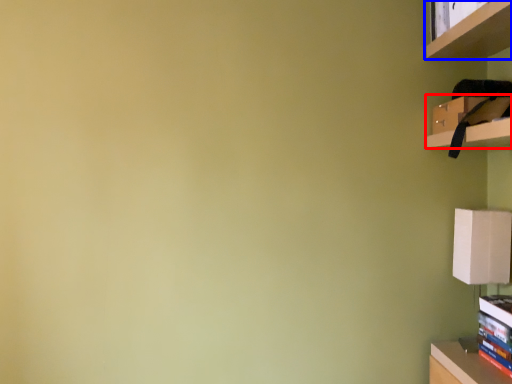
Question: Which of the following is the closest to the observer, cabinet (highlighted by a red box) or shelf (highlighted by a blue box)?

Choices:
 (A) cabinet
 (B) shelf

Answer: (B)